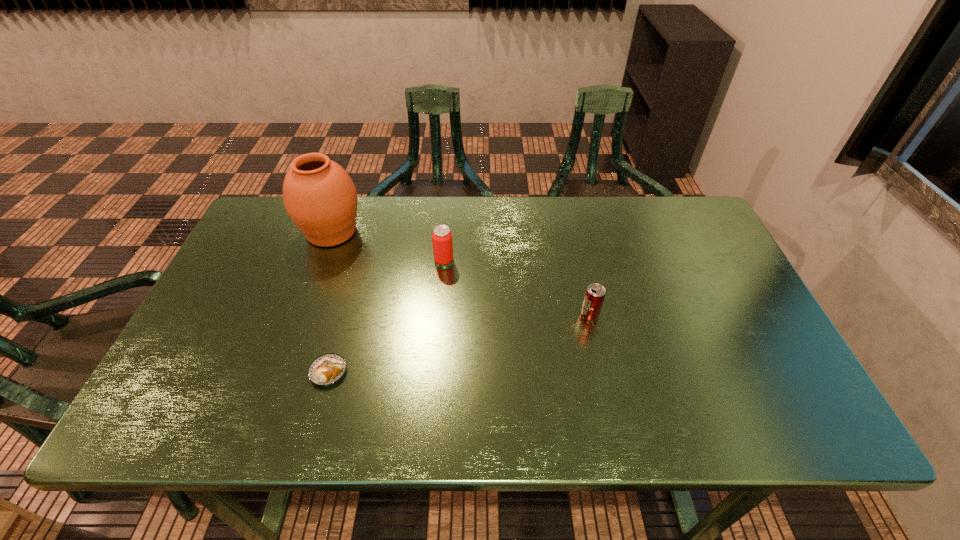
The width and height of the screenshot is (960, 540). I want to click on object that is the second closest one to the nearest object, so click(x=319, y=196).

Where is `vacant position in the image that satisfies the following two spatial constraints: 1. on the back side of the taller beer can; 2. on the right side of the shortest object`? vacant position in the image that satisfies the following two spatial constraints: 1. on the back side of the taller beer can; 2. on the right side of the shortest object is located at coordinates pos(359,260).

Find the location of a particular element. Image resolution: width=960 pixels, height=540 pixels. vacant region that satisfies the following two spatial constraints: 1. on the front side of the rightmost object; 2. on the left side of the taller beer can is located at coordinates (440, 315).

I want to click on free region that satisfies the following two spatial constraints: 1. on the front side of the shorter beer can; 2. on the right side of the third object from left to right, so click(x=440, y=315).